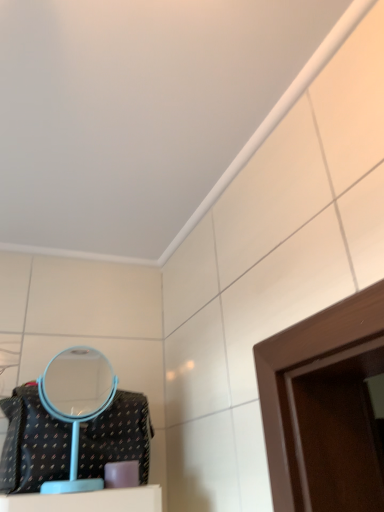
Question: From the image's perspective, is light blue plastic mirror at lower left under black textured fabric bag at lower left?

Choices:
 (A) no
 (B) yes

Answer: (A)

Question: Is black textured fabric bag at lower left at the back of light blue plastic mirror at lower left?

Choices:
 (A) yes
 (B) no

Answer: (A)

Question: From the image's perspective, is light blue plastic mirror at lower left on black textured fabric bag at lower left?

Choices:
 (A) no
 (B) yes

Answer: (B)

Question: Considering the relative sizes of light blue plastic mirror at lower left and black textured fabric bag at lower left in the image provided, is light blue plastic mirror at lower left shorter than black textured fabric bag at lower left?

Choices:
 (A) yes
 (B) no

Answer: (B)

Question: Is light blue plastic mirror at lower left directly adjacent to black textured fabric bag at lower left?

Choices:
 (A) yes
 (B) no

Answer: (B)

Question: Does light blue plastic mirror at lower left have a greater width compared to black textured fabric bag at lower left?

Choices:
 (A) yes
 (B) no

Answer: (B)

Question: Considering the relative sizes of black textured fabric bag at lower left and light blue plastic mirror at lower left in the image provided, is black textured fabric bag at lower left wider than light blue plastic mirror at lower left?

Choices:
 (A) no
 (B) yes

Answer: (B)

Question: Is light blue plastic mirror at lower left inside black textured fabric bag at lower left?

Choices:
 (A) no
 (B) yes

Answer: (A)

Question: Considering the relative sizes of black textured fabric bag at lower left and light blue plastic mirror at lower left in the image provided, is black textured fabric bag at lower left bigger than light blue plastic mirror at lower left?

Choices:
 (A) no
 (B) yes

Answer: (B)

Question: Is the position of black textured fabric bag at lower left less distant than that of light blue plastic mirror at lower left?

Choices:
 (A) no
 (B) yes

Answer: (B)

Question: From the image's perspective, does black textured fabric bag at lower left appear lower than light blue plastic mirror at lower left?

Choices:
 (A) no
 (B) yes

Answer: (B)

Question: From a real-world perspective, does black textured fabric bag at lower left sit lower than light blue plastic mirror at lower left?

Choices:
 (A) yes
 (B) no

Answer: (A)

Question: Considering their positions, is light blue plastic mirror at lower left located in front of or behind black textured fabric bag at lower left?

Choices:
 (A) behind
 (B) front

Answer: (A)